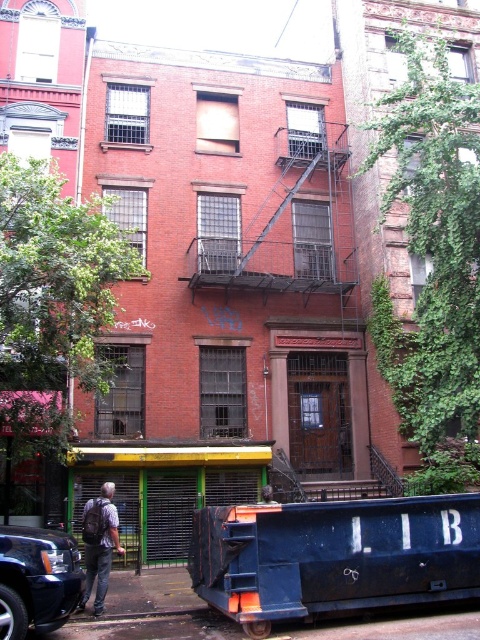
Question: Where is shiny black suv at lower left located in relation to denim jacket at lower left in the image?

Choices:
 (A) below
 (B) above

Answer: (B)

Question: Which of the following is the farthest from the observer?

Choices:
 (A) (0, 636)
 (B) (108, 499)

Answer: (B)

Question: Among these points, which one is farthest from the camera?

Choices:
 (A) (50, 532)
 (B) (101, 532)

Answer: (B)

Question: Is shiny black suv at lower left bigger than denim jacket at lower left?

Choices:
 (A) yes
 (B) no

Answer: (A)

Question: Can you confirm if shiny black suv at lower left is positioned to the right of denim jacket at lower left?

Choices:
 (A) no
 (B) yes

Answer: (A)